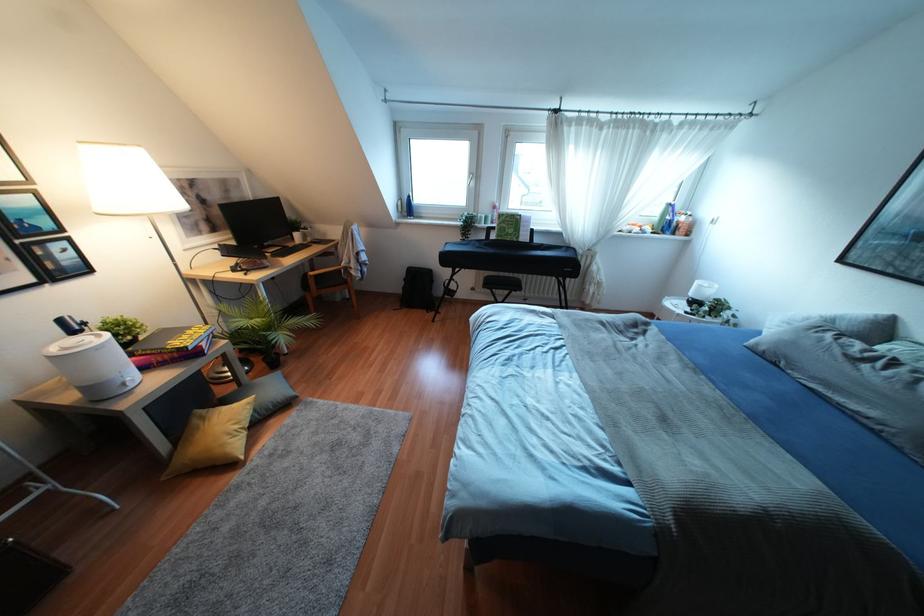
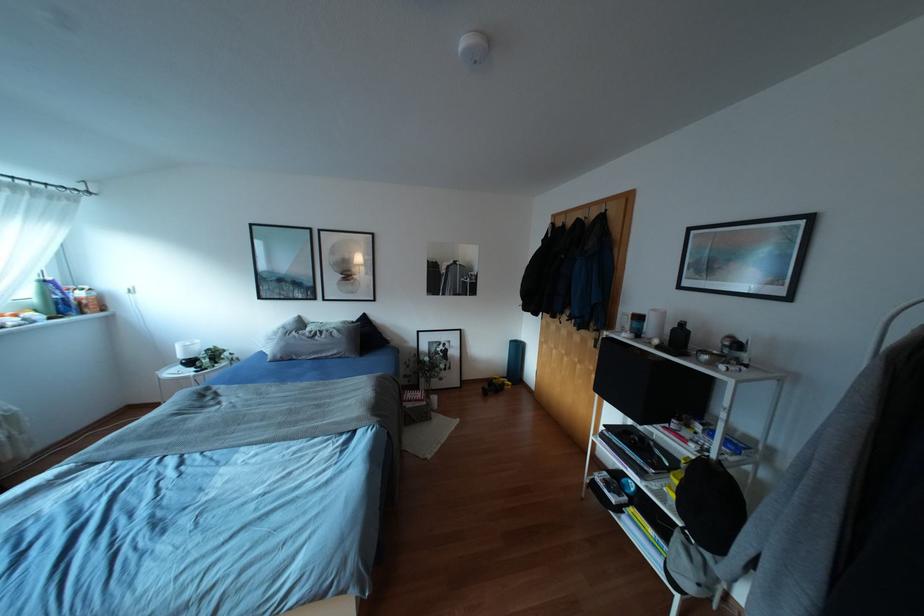
The point at (655,217) is marked in the first image. Where is the corresponding point in the second image?

(35, 301)